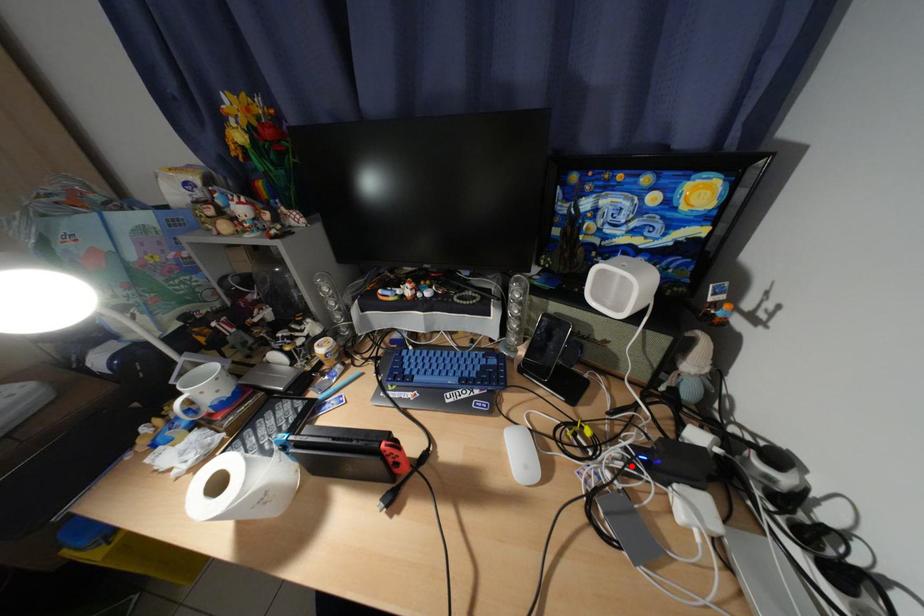
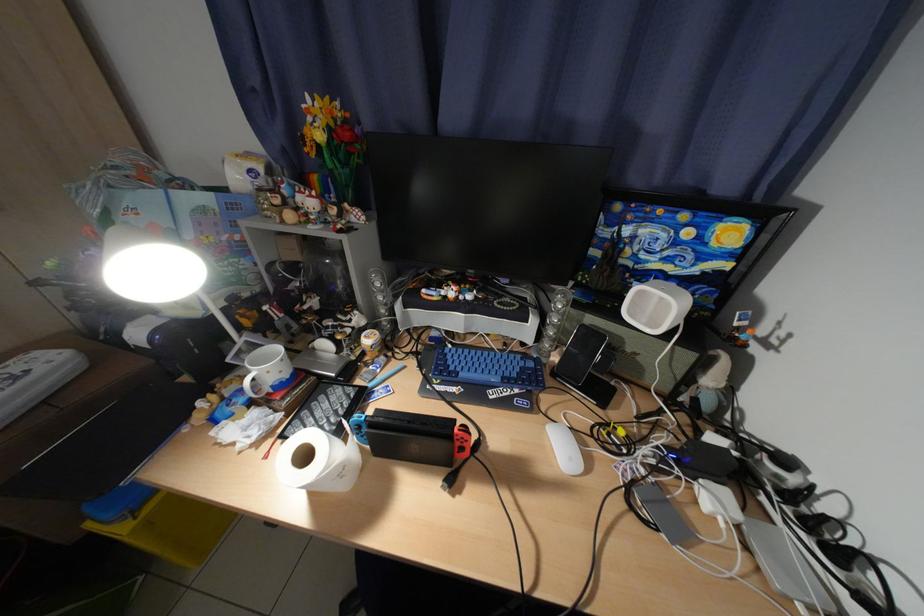
The point at the highlighted location is marked in the first image. Where is the corresponding point in the second image?

(664, 463)